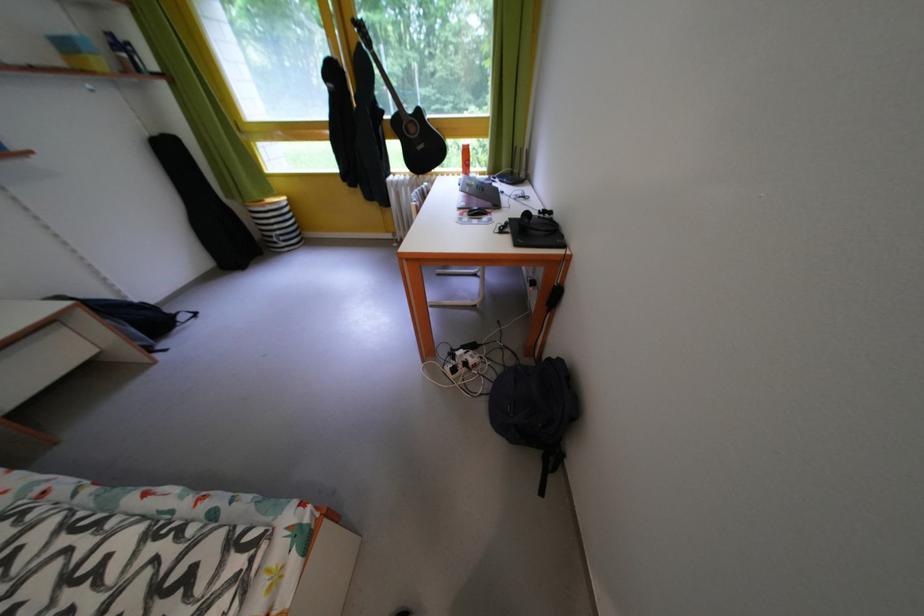
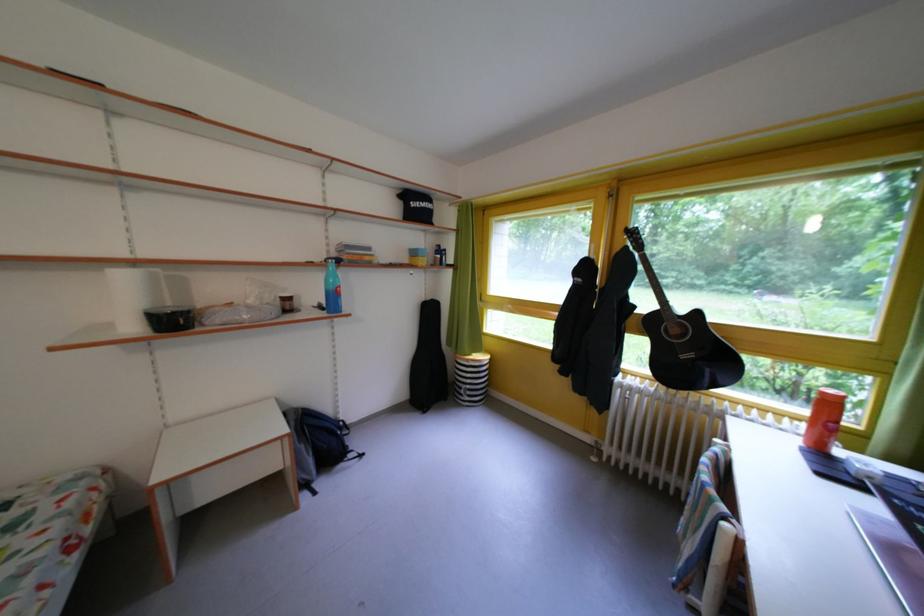
In the second image, find the point that corresponds to point 429,155 in the first image.

(693, 362)